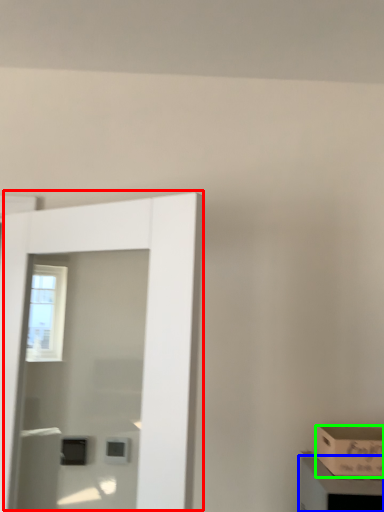
Question: Which object is the farthest from door (highlighted by a red box)? Choose among these: cabinetry (highlighted by a blue box) or box (highlighted by a green box).

Choices:
 (A) cabinetry
 (B) box

Answer: (B)